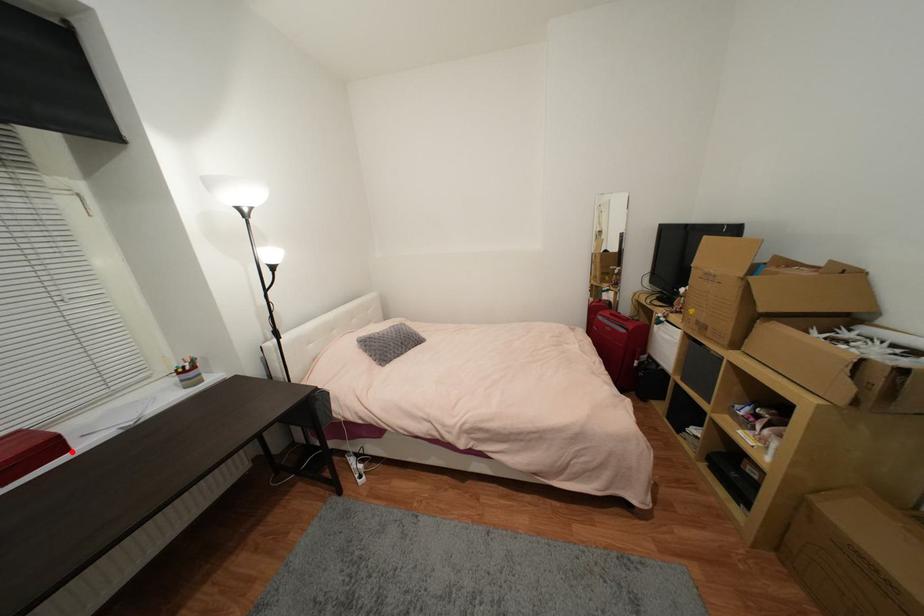
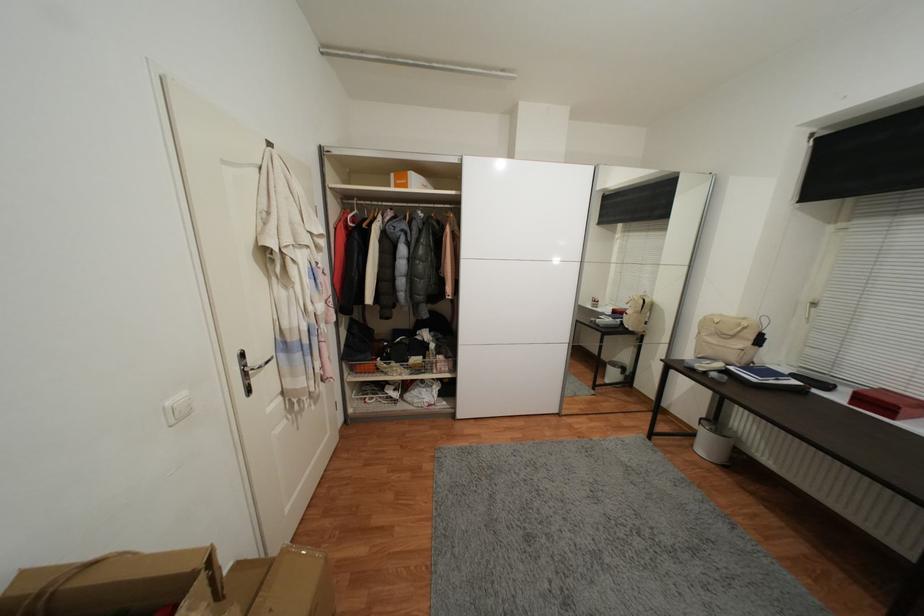
In the second image, find the point that corresponds to the highlighted location in the first image.

(897, 419)